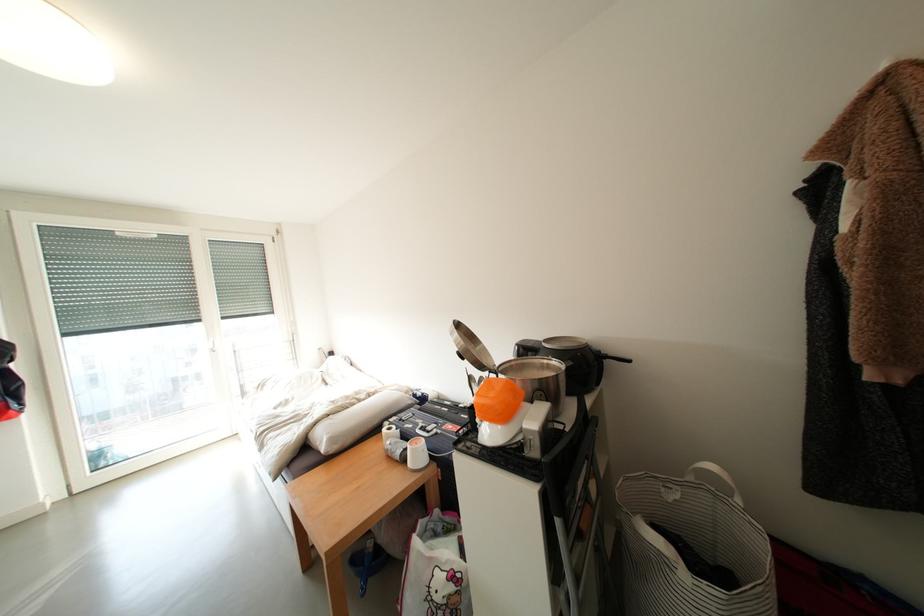
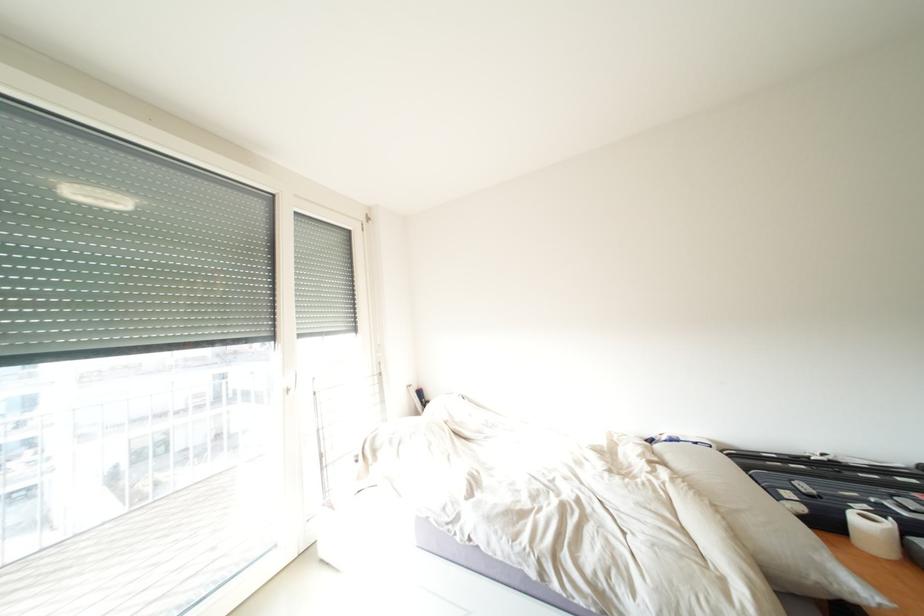
What movement of the cameraman would produce the second image?

The cameraman moved toward left, forward.